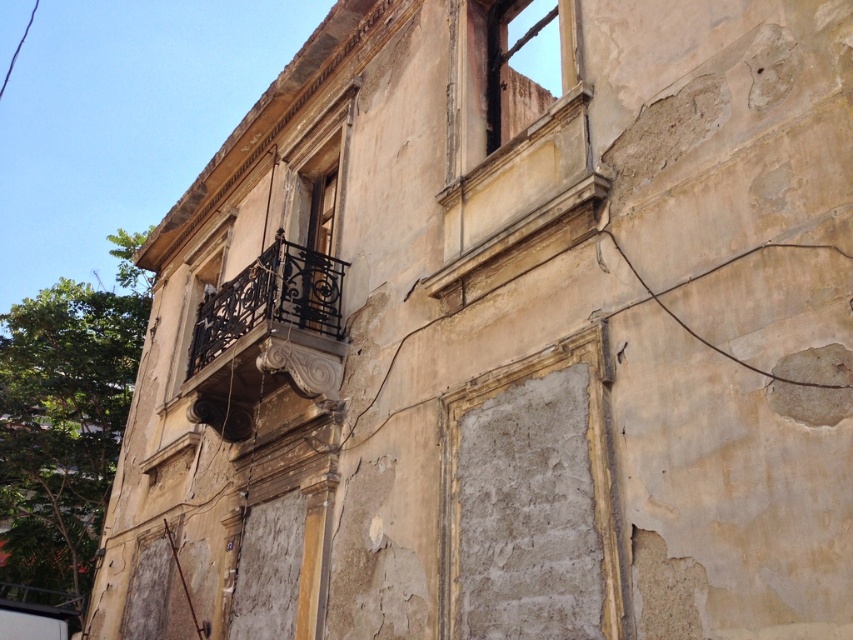
Is black wrought iron balcony at center below rusty metal window at upper center?

Yes, black wrought iron balcony at center is below rusty metal window at upper center.

Where is `black wrought iron balcony at center`? The height and width of the screenshot is (640, 853). black wrought iron balcony at center is located at coordinates (265, 337).